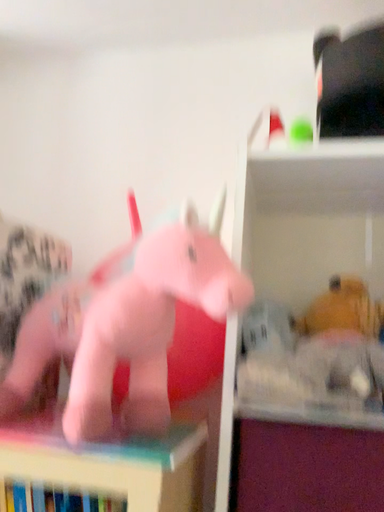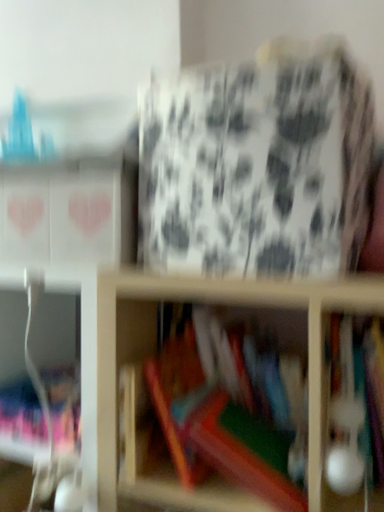
Question: How did the camera likely rotate when shooting the video?

Choices:
 (A) rotated left
 (B) rotated right

Answer: (A)